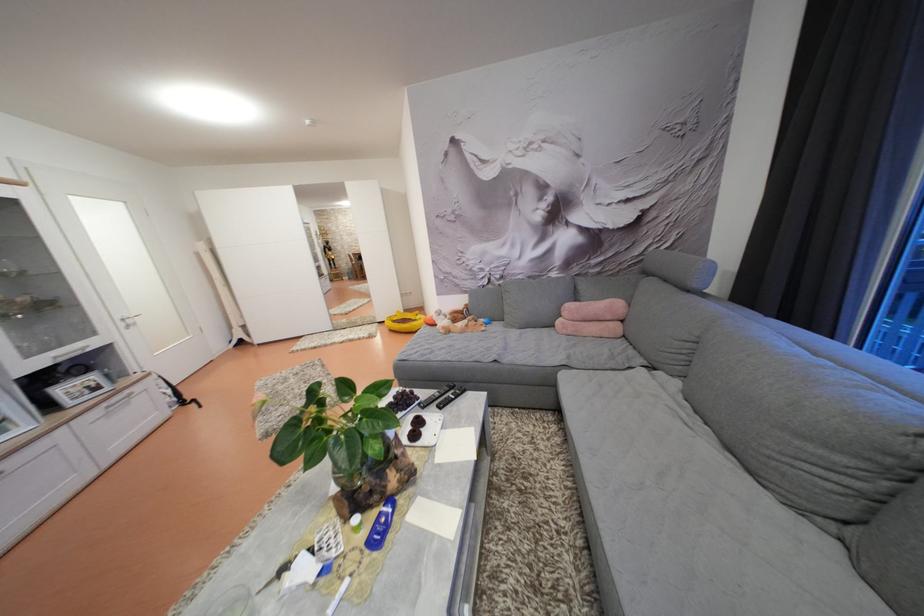
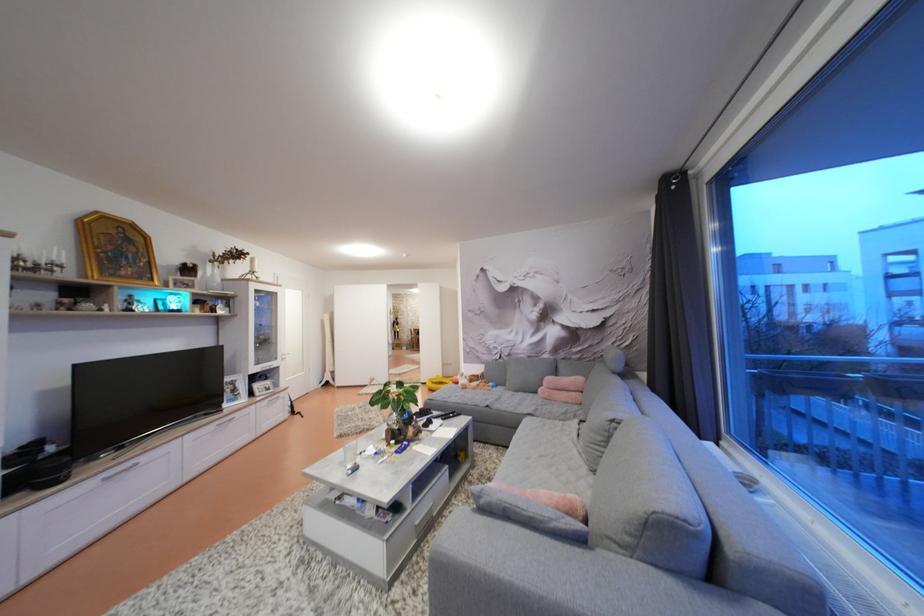
The point at (103, 394) is marked in the first image. Where is the corresponding point in the second image?

(274, 394)